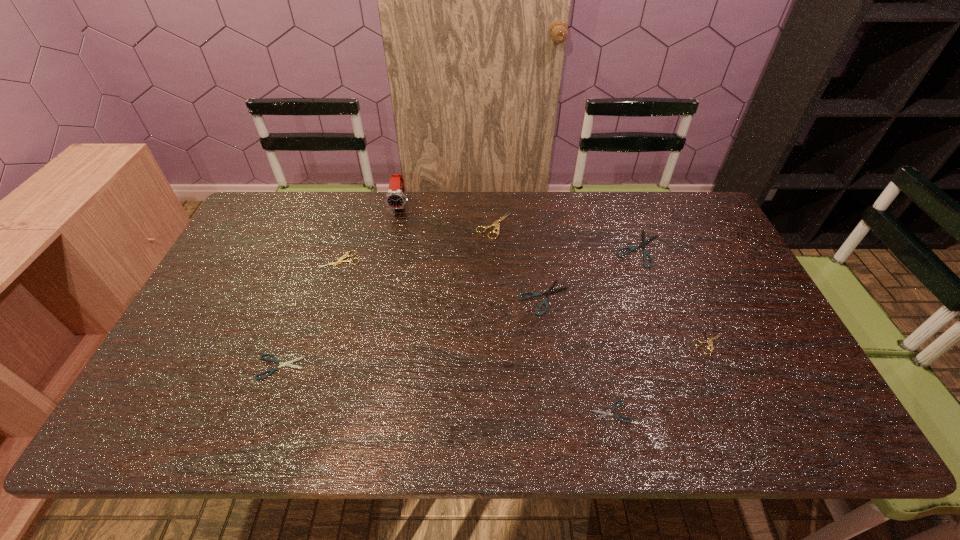
Where is `vacant area at the right edge of the desktop`? Image resolution: width=960 pixels, height=540 pixels. vacant area at the right edge of the desktop is located at coordinates (732, 271).

In the image, there is a desktop. Where is `free space at the far right corner`? This screenshot has height=540, width=960. free space at the far right corner is located at coordinates (682, 191).

Find the location of a particular element. The image size is (960, 540). vacant region between the rightmost black shears and the nearest beige shears is located at coordinates (675, 296).

Image resolution: width=960 pixels, height=540 pixels. I want to click on vacant region between the nearest black shears and the smallest beige shears, so click(x=660, y=377).

Identify the location of free space between the shortest shears and the leftmost beige shears. (475, 336).

The height and width of the screenshot is (540, 960). Identify the location of unoccupied position between the nearest beige shears and the farthest black shears. (675, 296).

Locate an element on the screen. free point between the nearest object and the nearest beige shears is located at coordinates (660, 377).

This screenshot has width=960, height=540. I want to click on blank region between the rightmost black shears and the fifth farthest object, so click(x=591, y=273).

This screenshot has height=540, width=960. What are the coordinates of `vacant space that's between the biggest black shears and the third farthest black shears` in the screenshot? It's located at (460, 308).

Find the location of `free space that is in between the rightmost beige shears and the shortest object`. free space that is in between the rightmost beige shears and the shortest object is located at coordinates (660, 377).